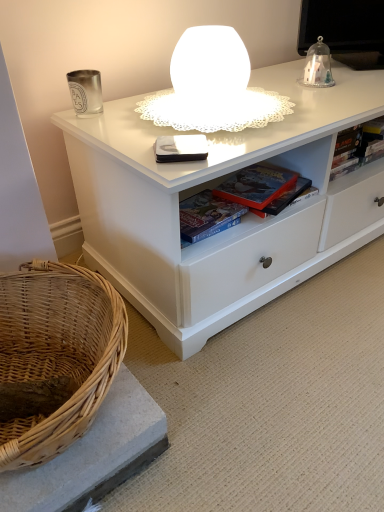
Question: Which direction should I rotate to look at matte board game at center, which ranks as the 3th book in back-to-front order?

Choices:
 (A) left
 (B) right

Answer: (B)

Question: From the image's perspective, would you say hardcover book at upper right, acting as the first book starting from the right, is shown under white frosted glass table lamp at upper center?

Choices:
 (A) no
 (B) yes

Answer: (B)

Question: Is hardcover book at upper right, which is the fourth book from left to right, facing towards white frosted glass table lamp at upper center?

Choices:
 (A) yes
 (B) no

Answer: (B)

Question: Is hardcover book at upper right, acting as the fourth book starting from the front, surrounding white frosted glass table lamp at upper center?

Choices:
 (A) no
 (B) yes

Answer: (A)

Question: Does hardcover book at upper right, which is the fourth book from left to right, come behind white frosted glass table lamp at upper center?

Choices:
 (A) no
 (B) yes

Answer: (B)

Question: Is hardcover book at upper right, which is the fourth book from left to right, wider than white frosted glass table lamp at upper center?

Choices:
 (A) yes
 (B) no

Answer: (B)

Question: From a real-world perspective, is hardcover book at upper right, acting as the first book starting from the right, on top of white frosted glass table lamp at upper center?

Choices:
 (A) yes
 (B) no

Answer: (B)

Question: Considering the relative sizes of white frosted glass table lamp at upper center and matte plastic book at center, the 2th book positioned from the back, in the image provided, is white frosted glass table lamp at upper center shorter than matte plastic book at center, the 2th book positioned from the back,?

Choices:
 (A) yes
 (B) no

Answer: (B)

Question: From the image's perspective, is white frosted glass table lamp at upper center below matte plastic book at center, the 2th book positioned from the back?

Choices:
 (A) no
 (B) yes

Answer: (A)

Question: Is white frosted glass table lamp at upper center further to the viewer compared to matte plastic book at center, acting as the 3th book starting from the left?

Choices:
 (A) yes
 (B) no

Answer: (B)

Question: Considering the relative sizes of white frosted glass table lamp at upper center and matte plastic book at center, acting as the 3th book starting from the left, in the image provided, is white frosted glass table lamp at upper center taller than matte plastic book at center, acting as the 3th book starting from the left,?

Choices:
 (A) yes
 (B) no

Answer: (A)

Question: Is white frosted glass table lamp at upper center placed right next to matte plastic book at center, which is the third book from front to back?

Choices:
 (A) yes
 (B) no

Answer: (B)

Question: Can you confirm if white frosted glass table lamp at upper center is bigger than matte plastic book at center, which is the third book from front to back?

Choices:
 (A) yes
 (B) no

Answer: (A)

Question: Would you say hardcover book at upper right, the first book positioned from the back, contains matte plastic book at center, acting as the 3th book starting from the left?

Choices:
 (A) no
 (B) yes

Answer: (A)